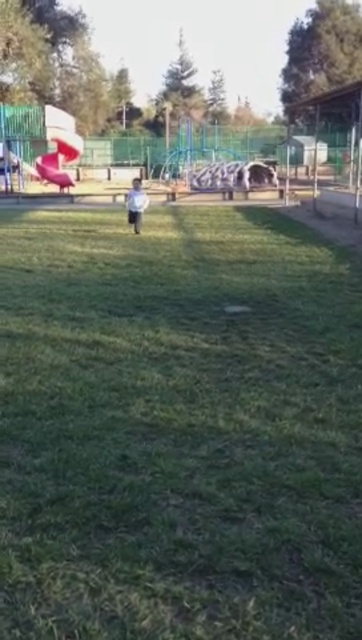
Between green grassy field at center and white matte shirt at center, which one appears on the right side from the viewer's perspective?

green grassy field at center is more to the right.

Is point (220, 548) positioned before point (132, 180)?

Yes, it is.

Identify the location of green grassy field at center. (178, 428).

Who is shorter, smooth plastic slide at upper left or white matte shirt at center?

With less height is smooth plastic slide at upper left.

Who is lower down, smooth plastic slide at upper left or white matte shirt at center?

white matte shirt at center is lower down.

Who is more forward, (59, 156) or (137, 202)?

Point (137, 202) is more forward.

Find the location of a particular element. The image size is (362, 640). smooth plastic slide at upper left is located at coordinates (59, 148).

Can you confirm if green grassy field at center is wider than smooth plastic slide at upper left?

Indeed, green grassy field at center has a greater width compared to smooth plastic slide at upper left.

Measure the distance from green grassy field at center to smooth plastic slide at upper left.

green grassy field at center and smooth plastic slide at upper left are 60.34 feet apart.

Is point (44, 380) closer to viewer compared to point (45, 134)?

That is True.

I want to click on green grassy field at center, so click(x=178, y=428).